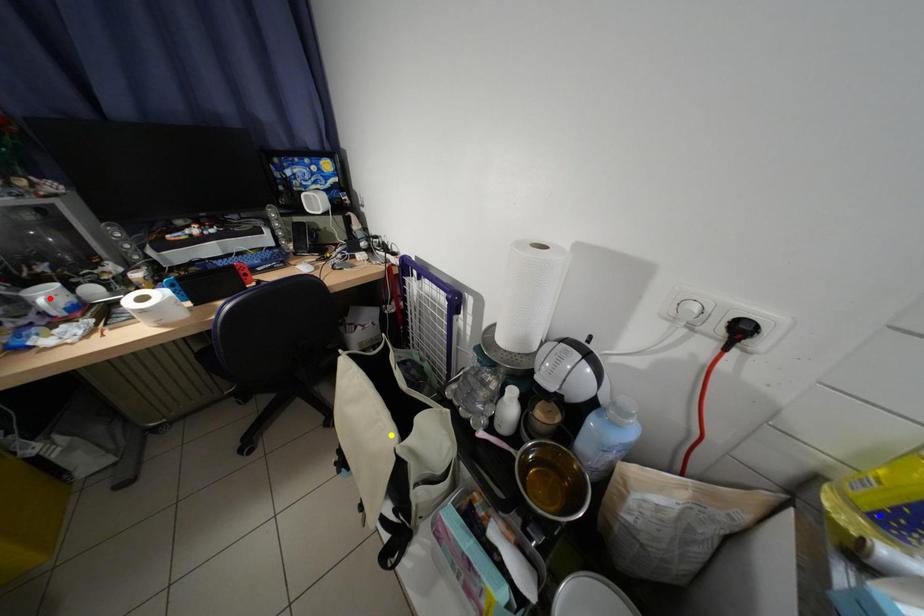
Order these from nearest to farthest:
1. blue point
2. red point
3. yellow point

blue point, yellow point, red point